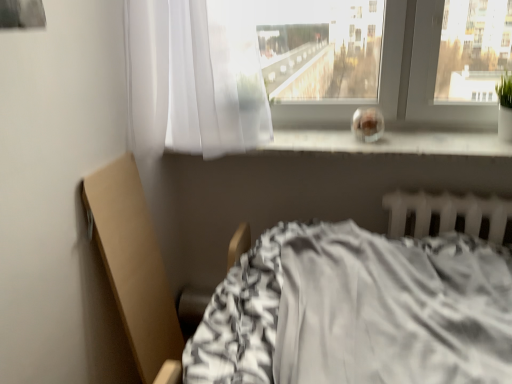
Question: Is point (490, 228) positioned closer to the camera than point (373, 144)?

Choices:
 (A) farther
 (B) closer

Answer: (B)

Question: Based on their positions, is white plastic radiator at lower right located to the left or right of transparent glass at center?

Choices:
 (A) right
 (B) left

Answer: (A)

Question: Estimate the real-world distances between objects in this image. Which object is closer to the gray fabric bed at lower center?

Choices:
 (A) sheer white curtain at upper center
 (B) white plastic radiator at lower right
 (C) transparent glass at center

Answer: (B)

Question: Which object is positioned farthest from the sheer white curtain at upper center?

Choices:
 (A) white plastic radiator at lower right
 (B) transparent glass at center
 (C) gray fabric bed at lower center

Answer: (C)